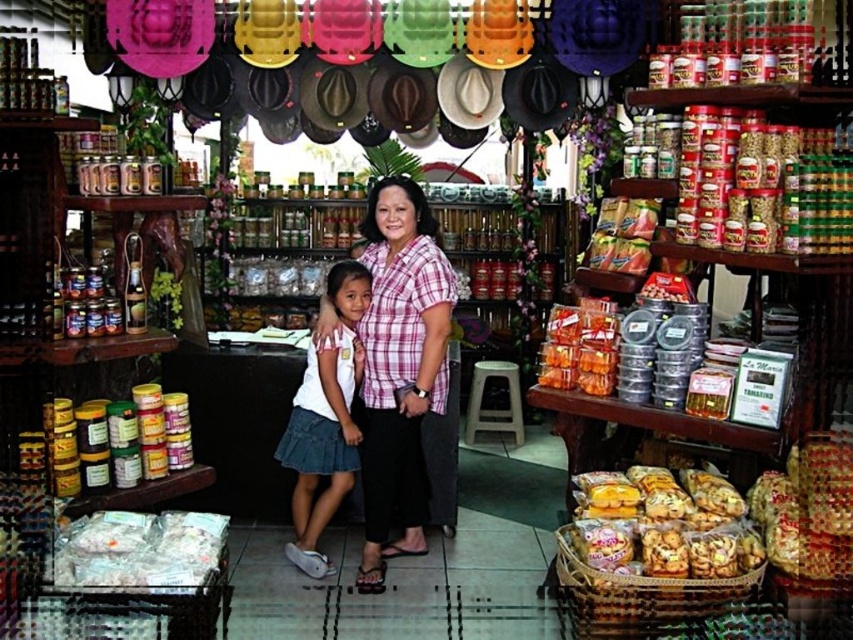
In the scene shown: Does translucent plastic bag of cookies at center have a lesser height compared to white translucent bag at center?

In fact, translucent plastic bag of cookies at center may be taller than white translucent bag at center.

How far apart are translucent plastic bag of cookies at center and white translucent bag at center?

They are 1.54 meters apart.

What do you see at coordinates (662, 524) in the screenshot? The width and height of the screenshot is (853, 640). I see `translucent plastic bag of cookies at center` at bounding box center [662, 524].

This screenshot has height=640, width=853. What are the coordinates of `translucent plastic bag of cookies at center` in the screenshot? It's located at (662, 524).

Is white cotton shirt at center in front of translucent plastic containers at center right?

No, white cotton shirt at center is further to the viewer.

Measure the distance between white cotton shirt at center and camera.

white cotton shirt at center and camera are 11.77 feet apart.

Find the location of a particular element. This screenshot has height=640, width=853. white cotton shirt at center is located at coordinates (325, 420).

In the scene shown: Who is positioned more to the right, pink plaid shirt at center or translucent plastic bag of cookies at center?

Positioned to the right is translucent plastic bag of cookies at center.

Can you confirm if pink plaid shirt at center is positioned above translucent plastic bag of cookies at center?

Correct, pink plaid shirt at center is located above translucent plastic bag of cookies at center.

The height and width of the screenshot is (640, 853). What do you see at coordinates (399, 365) in the screenshot?
I see `pink plaid shirt at center` at bounding box center [399, 365].

At what (x,y) coordinates should I click in order to perform the action: click on pink plaid shirt at center. Please return your answer as a coordinate pair (x, y). This screenshot has width=853, height=640. Looking at the image, I should click on point(399,365).